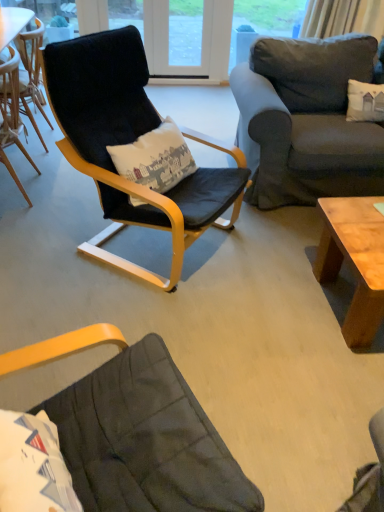
Find the location of a particular element. Image resolution: width=384 pixels, height=512 pixels. vacant space in front of wooden chair at left, which is counted as the first chair, starting from the left is located at coordinates (24, 225).